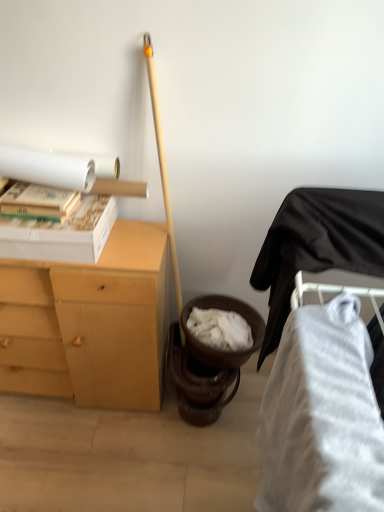
Question: Is white matte roll at upper left in front of or behind light brown wood desk at left in the image?

Choices:
 (A) behind
 (B) front

Answer: (A)

Question: Choose the correct answer: Is white matte roll at upper left inside light brown wood desk at left or outside it?

Choices:
 (A) outside
 (B) inside

Answer: (A)

Question: Which of these objects is positioned closest to the white striped fabric at lower right?

Choices:
 (A) light brown wood desk at left
 (B) white cardboard box at upper left
 (C) white matte book at upper left
 (D) white matte roll at upper left

Answer: (A)

Question: Which object is positioned farthest from the white matte roll at upper left?

Choices:
 (A) white striped fabric at lower right
 (B) light brown wood desk at left
 (C) white matte book at upper left
 (D) white cardboard box at upper left

Answer: (A)